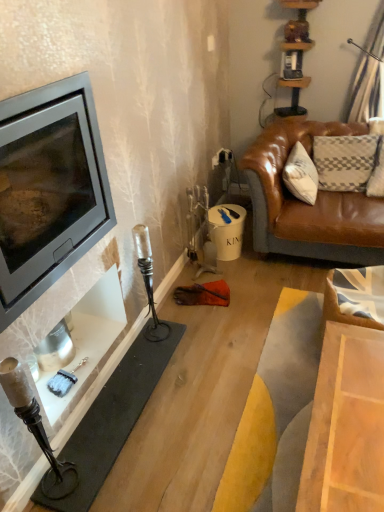
Where is `matte black fireplace at left`? The height and width of the screenshot is (512, 384). matte black fireplace at left is located at coordinates (49, 189).

What do you see at coordinates (49, 189) in the screenshot?
I see `matte black fireplace at left` at bounding box center [49, 189].

What do you see at coordinates (50, 189) in the screenshot?
I see `matte black wood burning stove at left` at bounding box center [50, 189].

The image size is (384, 512). Find the location of `matte black wood burning stove at left`. matte black wood burning stove at left is located at coordinates [x=50, y=189].

Find the location of a particular element. The image size is (384, 512). matte black fireplace at left is located at coordinates pos(49,189).

Looking at this image, can you confirm if matte black wood burning stove at left is positioned to the left of matte black fireplace at left?

Correct, you'll find matte black wood burning stove at left to the left of matte black fireplace at left.

Is matte black wood burning stove at left behind matte black fireplace at left?

No, matte black wood burning stove at left is in front of matte black fireplace at left.

Considering the positions of point (40, 138) and point (74, 138), is point (40, 138) closer or farther from the camera than point (74, 138)?

Point (40, 138).

Consider the image. From the image's perspective, between matte black wood burning stove at left and matte black fireplace at left, who is located below?

matte black fireplace at left appears lower in the image.

From a real-world perspective, relative to matte black fireplace at left, is matte black wood burning stove at left vertically above or below?

matte black wood burning stove at left is above matte black fireplace at left.

In terms of width, does matte black wood burning stove at left look wider or thinner when compared to matte black fireplace at left?

Clearly, matte black wood burning stove at left has more width compared to matte black fireplace at left.

Considering the sizes of matte black wood burning stove at left and matte black fireplace at left in the image, is matte black wood burning stove at left taller or shorter than matte black fireplace at left?

matte black wood burning stove at left is taller than matte black fireplace at left.

Does matte black wood burning stove at left have a smaller size compared to matte black fireplace at left?

Actually, matte black wood burning stove at left might be larger than matte black fireplace at left.

Can we say matte black wood burning stove at left lies outside matte black fireplace at left?

Absolutely, matte black wood burning stove at left is external to matte black fireplace at left.

From the picture: Is matte black wood burning stove at left next to matte black fireplace at left?

Yes, matte black wood burning stove at left is next to matte black fireplace at left.

Does matte black wood burning stove at left turn towards matte black fireplace at left?

No, matte black wood burning stove at left is not aimed at matte black fireplace at left.

Where is `fireplace directly beneath the matte black wood burning stove at left (from a real-world perspective)`? fireplace directly beneath the matte black wood burning stove at left (from a real-world perspective) is located at coordinates (49, 189).

Can you confirm if matte black fireplace at left is positioned to the right of matte black wood burning stove at left?

Indeed, matte black fireplace at left is positioned on the right side of matte black wood burning stove at left.

Which is in front, matte black fireplace at left or matte black wood burning stove at left?

matte black wood burning stove at left is closer to the camera.

Which is in front, point (44, 130) or point (27, 154)?

The point (44, 130) is more forward.

From the image's perspective, is matte black fireplace at left located beneath matte black wood burning stove at left?

Correct, matte black fireplace at left appears lower than matte black wood burning stove at left in the image.

From a real-world perspective, is matte black fireplace at left physically above matte black wood burning stove at left?

No.

Which of these two, matte black fireplace at left or matte black wood burning stove at left, is thinner?

matte black fireplace at left.

From their relative heights in the image, would you say matte black fireplace at left is taller or shorter than matte black wood burning stove at left?

Clearly, matte black fireplace at left is shorter compared to matte black wood burning stove at left.

Which of these two, matte black fireplace at left or matte black wood burning stove at left, is bigger?

matte black wood burning stove at left is bigger.

Is matte black fireplace at left not inside matte black wood burning stove at left?

Absolutely, matte black fireplace at left is external to matte black wood burning stove at left.

Is matte black fireplace at left placed right next to matte black wood burning stove at left?

Yes, matte black fireplace at left is in contact with matte black wood burning stove at left.

Could you tell me if matte black fireplace at left is facing matte black wood burning stove at left?

No, matte black fireplace at left is not facing towards matte black wood burning stove at left.

What's the angular difference between matte black fireplace at left and matte black wood burning stove at left's facing directions?

The angular difference between matte black fireplace at left and matte black wood burning stove at left is 1.37 degrees.

I want to click on wood burning stove that appears above the matte black fireplace at left (from a real-world perspective), so click(50, 189).

You are a GUI agent. You are given a task and a screenshot of the screen. Output one action in this format:
    pyautogui.click(x=<x>, y=<y>)
    Task: Click on the wood burning stove above the matte black fireplace at left (from a real-world perspective)
    This screenshot has width=384, height=512.
    Given the screenshot: What is the action you would take?
    pyautogui.click(x=50, y=189)

Identify the location of wood burning stove that appears in front of the matte black fireplace at left. (50, 189).